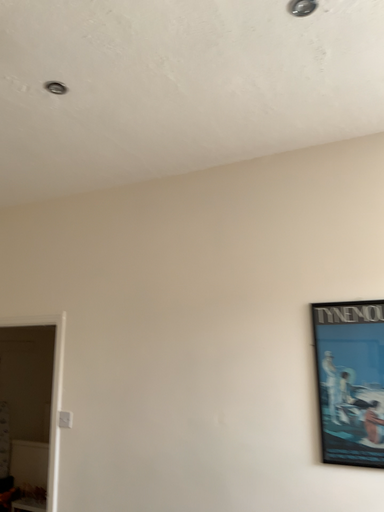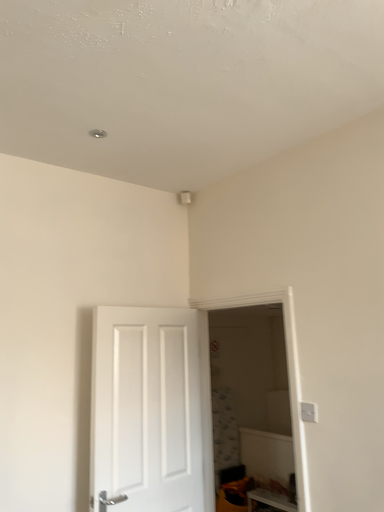
Question: How did the camera likely rotate when shooting the video?

Choices:
 (A) rotated right
 (B) rotated left

Answer: (B)